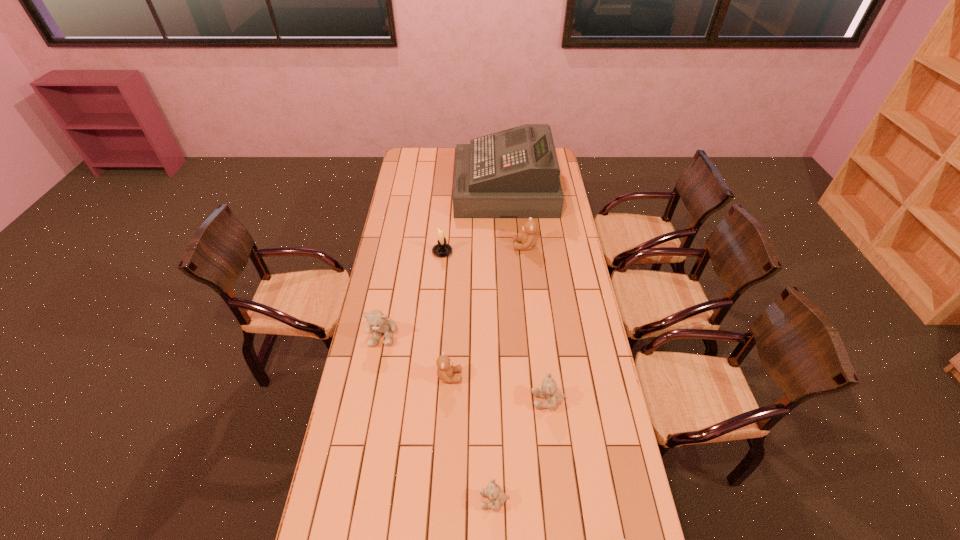
Identify which brown teddy bear is the closest to the farthest brown teddy bear. Please provide its 2D coordinates. Your answer should be formatted as a tuple, i.e. [(x, y)], where the tuple contains the x and y coordinates of a point satisfying the conditions above.

[(445, 370)]

Select which brown teddy bear appears as the third closest to the gray cash register. Please provide its 2D coordinates. Your answer should be formatted as a tuple, i.e. [(x, y)], where the tuple contains the x and y coordinates of a point satisfying the conditions above.

[(623, 539)]

Find the location of `the second closest gray teddy bear to the fourth teddy bear from right to left`. the second closest gray teddy bear to the fourth teddy bear from right to left is located at coordinates [x=376, y=320].

Locate an element on the screen. This screenshot has width=960, height=540. gray teddy bear that can be found as the closest to the third nearest teddy bear is located at coordinates (498, 497).

In order to click on vacant space that satisfies the following two spatial constraints: 1. on the front-facing side of the farthest object; 2. on the face of the farthest gray teddy bear in this screenshot , I will do `click(516, 334)`.

Locate an element on the screen. The height and width of the screenshot is (540, 960). vacant area that satisfies the following two spatial constraints: 1. on the front-facing side of the gray cash register; 2. on the front side of the white candle holder is located at coordinates (510, 252).